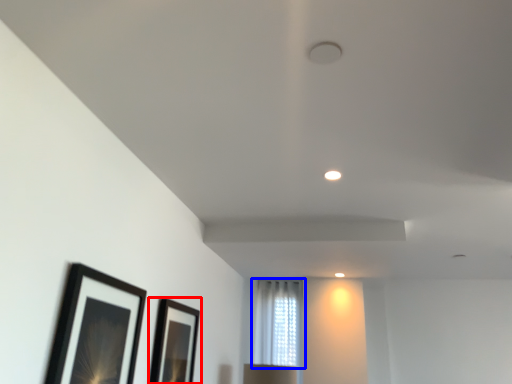
Question: Which of the following is the closest to the observer, picture frame (highlighted by a red box) or window (highlighted by a blue box)?

Choices:
 (A) picture frame
 (B) window

Answer: (A)